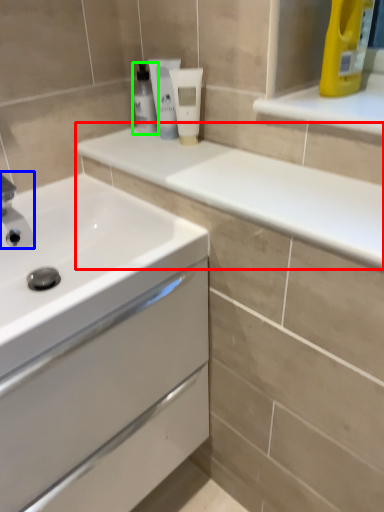
Question: Which object is positioned farthest from counter top (highlighted by a red box)? Select from plumbing fixture (highlighted by a blue box) and mouthwash (highlighted by a green box).

Choices:
 (A) plumbing fixture
 (B) mouthwash

Answer: (A)